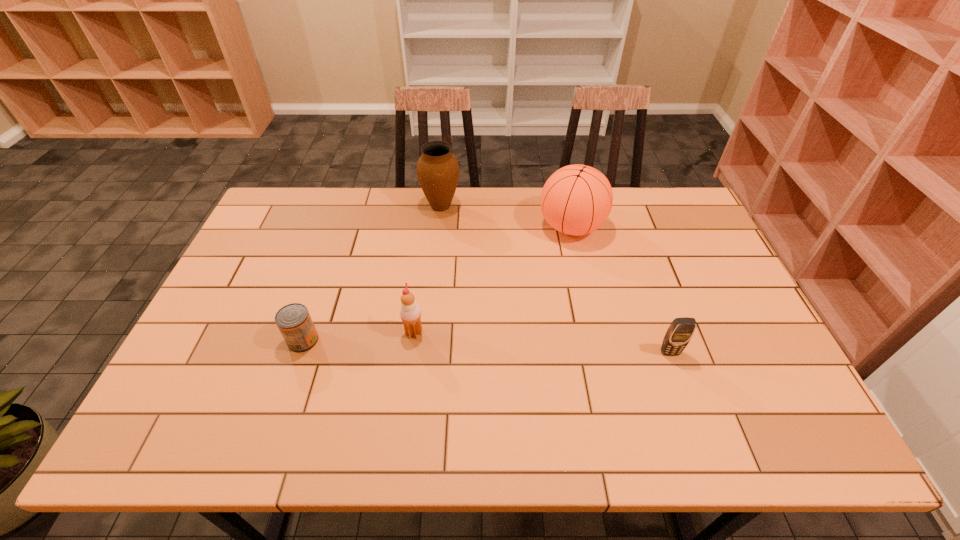
At what (x,y) coordinates should I click in order to perform the action: click on vacant space that's between the cellular telephone and the icecream. Please return your answer as a coordinate pair (x, y). The image size is (960, 540). Looking at the image, I should click on (541, 342).

Locate an element on the screen. empty space that is in between the can and the urn is located at coordinates (372, 273).

This screenshot has height=540, width=960. Find the location of `vacant area that lies between the third shortest object and the fourth object from left to right`. vacant area that lies between the third shortest object and the fourth object from left to right is located at coordinates (492, 280).

In order to click on vacant space that's between the fourth object from left to right and the urn in this screenshot , I will do `click(506, 217)`.

Find the location of a particular element. This screenshot has height=540, width=960. free area in between the urn and the fourth tallest object is located at coordinates click(555, 279).

Where is `blank region between the shortest object and the second shortest object`? Image resolution: width=960 pixels, height=540 pixels. blank region between the shortest object and the second shortest object is located at coordinates (487, 346).

The height and width of the screenshot is (540, 960). Find the location of `free spot between the urn and the shortest object`. free spot between the urn and the shortest object is located at coordinates (372, 273).

The image size is (960, 540). In order to click on free space between the cellular telephone and the urn in this screenshot , I will do `click(555, 279)`.

At what (x,y) coordinates should I click in order to perform the action: click on blank region between the urn and the rightmost object. Please return your answer as a coordinate pair (x, y). Looking at the image, I should click on (555, 279).

Find the location of a particular element. The height and width of the screenshot is (540, 960). empty space that is in between the shortest object and the urn is located at coordinates (372, 273).